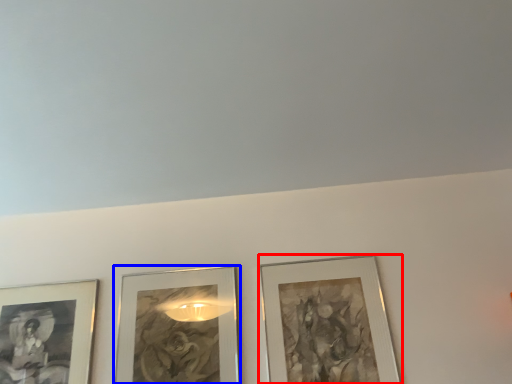
Question: Which of the following is the closest to the observer, picture frame (highlighted by a red box) or picture frame (highlighted by a blue box)?

Choices:
 (A) picture frame
 (B) picture frame

Answer: (A)